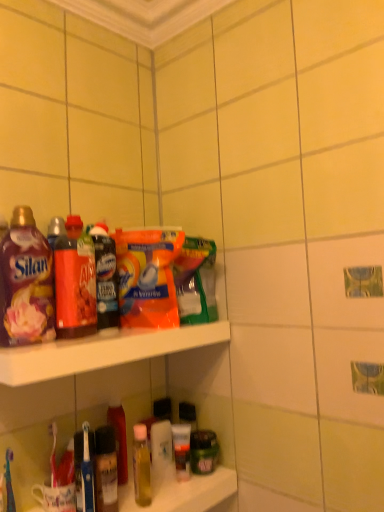
This screenshot has height=512, width=384. Describe the element at coordinates (147, 277) in the screenshot. I see `orange plastic cleaning product at center` at that location.

Measure the distance between point (105,311) and camera.

A distance of 3.42 feet exists between point (105,311) and camera.

Locate an element on the screen. matte plastic shelf at upper center is located at coordinates (102, 351).

At what (x,y) coordinates should I click in order to perform the action: click on matte red bottle at left, placed as the second bottle when sorted from back to front. Please return your answer as a coordinate pair (x, y). Looking at the image, I should click on (75, 282).

The width and height of the screenshot is (384, 512). I want to click on translucent plastic bottle at lower center, the third bottle when ordered from top to bottom, so click(x=119, y=438).

The height and width of the screenshot is (512, 384). I want to click on orange plastic cleaning product at center, so click(x=147, y=277).

Is the depth of matte red bottle at left, arranged as the second bottle when ordered from the bottom, less than that of matte plastic bottle at upper left?

Yes, it is.

Based on the photo, is matte red bottle at left, which is counted as the second bottle, starting from the front, outside of matte plastic bottle at upper left?

Absolutely, matte red bottle at left, which is counted as the second bottle, starting from the front, is external to matte plastic bottle at upper left.

Can you tell me how much matte red bottle at left, which is counted as the second bottle, starting from the front, and matte plastic bottle at upper left differ in facing direction?

The angle between the facing direction of matte red bottle at left, which is counted as the second bottle, starting from the front, and the facing direction of matte plastic bottle at upper left is 0.000106 degrees.

Is matte plastic bottle at upper left facing towards translucent plastic bottle at lower center, which is counted as the 3th bottle, starting from the front?

No, matte plastic bottle at upper left is not facing towards translucent plastic bottle at lower center, which is counted as the 3th bottle, starting from the front.

From a real-world perspective, is matte plastic bottle at upper left above or below translucent plastic bottle at lower center, the third bottle when ordered from top to bottom?

From a real-world perspective, matte plastic bottle at upper left is physically above translucent plastic bottle at lower center, the third bottle when ordered from top to bottom.

Considering the sizes of matte plastic bottle at upper left and translucent plastic bottle at lower center, acting as the first bottle starting from the back, in the image, is matte plastic bottle at upper left bigger or smaller than translucent plastic bottle at lower center, acting as the first bottle starting from the back,?

Considering their sizes, matte plastic bottle at upper left takes up more space than translucent plastic bottle at lower center, acting as the first bottle starting from the back.

Is orange plastic cleaning product at center wider or thinner than translucent plastic bottle at lower center, acting as the first bottle starting from the back?

Clearly, orange plastic cleaning product at center has more width compared to translucent plastic bottle at lower center, acting as the first bottle starting from the back.

From the image's perspective, which is below, orange plastic cleaning product at center or translucent plastic bottle at lower center, acting as the first bottle starting from the back?

translucent plastic bottle at lower center, acting as the first bottle starting from the back, appears lower in the image.

Based on the photo, is orange plastic cleaning product at center turned away from translucent plastic bottle at lower center, the third bottle when ordered from top to bottom?

No, translucent plastic bottle at lower center, the third bottle when ordered from top to bottom, is not at the back of orange plastic cleaning product at center.

Between translucent plastic bottle at lower center, acting as the first bottle starting from the back, and matte plastic bottle at upper left, which one is positioned in front?

matte plastic bottle at upper left is more forward.

Which is in front, point (116, 414) or point (99, 222)?

The point (116, 414) is closer to the camera.

You are a GUI agent. You are given a task and a screenshot of the screen. Output one action in this format:
    pyautogui.click(x=<x>, y=<y>)
    Task: Click on the product above the translucent plastic bottle at lower center, which is counted as the 3th bottle, starting from the front (from a real-world perspective)
    
    Given the screenshot: What is the action you would take?
    pyautogui.click(x=105, y=278)

Considering the positions of points (2, 334) and (138, 355), is point (2, 334) closer to camera compared to point (138, 355)?

Yes, point (2, 334) is closer to viewer.

From a real-world perspective, does matte plastic bottle at left, the first bottle viewed from the top, sit lower than matte plastic shelf at upper center?

No, from a real-world perspective, matte plastic bottle at left, the first bottle viewed from the top, is not below matte plastic shelf at upper center.

Could matte plastic shelf at upper center be considered to be inside matte plastic bottle at left, which is the third bottle from bottom to top?

No.

Is matte plastic bottle at left, which is the third bottle from back to front, shorter than matte plastic shelf at upper center?

No, matte plastic bottle at left, which is the third bottle from back to front, is not shorter than matte plastic shelf at upper center.

How different are the orientations of matte plastic shelf at upper center and orange plastic cleaning product at center in degrees?

matte plastic shelf at upper center and orange plastic cleaning product at center are facing 2.67e-05 degrees away from each other.

Which of these two, matte plastic shelf at upper center or orange plastic cleaning product at center, is bigger?

orange plastic cleaning product at center is bigger.

Is matte plastic shelf at upper center shorter than orange plastic cleaning product at center?

Yes.

How much distance is there between matte plastic shelf at upper center and orange plastic cleaning product at center?

They are 15.53 centimeters apart.

Does matte plastic bottle at upper left have a greater height compared to orange plastic cleaning product at center?

Yes, matte plastic bottle at upper left is taller than orange plastic cleaning product at center.

Is matte plastic bottle at upper left looking in the opposite direction of orange plastic cleaning product at center?

No, matte plastic bottle at upper left is not facing the opposite direction of orange plastic cleaning product at center.

Is matte plastic bottle at upper left next to orange plastic cleaning product at center?

Yes, matte plastic bottle at upper left is with orange plastic cleaning product at center.

Considering their positions, is matte plastic bottle at upper left located in front of or behind orange plastic cleaning product at center?

Visually, matte plastic bottle at upper left is located behind orange plastic cleaning product at center.

Locate an element on the screen. The height and width of the screenshot is (512, 384). bottle that is the 1st object to the left of the matte plastic bottle at upper left, starting at the anchor is located at coordinates pos(75,282).

Image resolution: width=384 pixels, height=512 pixels. I want to click on bottle on the right of the matte plastic bottle at upper left, so coord(119,438).

Looking at the image, which one is located closer to matte plastic shelf at upper center, translucent plastic bottle at lower center, the third bottle when ordered from top to bottom, or orange plastic cleaning product at center?

orange plastic cleaning product at center is closer to matte plastic shelf at upper center.

Estimate the real-world distances between objects in this image. Which object is closer to matte plastic bottle at upper left, matte plastic shelf at upper center or translucent plastic bottle at lower center, the third bottle when ordered from top to bottom?

matte plastic shelf at upper center.

Considering their positions, is translucent plastic bottle at lower center, which ranks as the 1th bottle in bottom-to-top order, positioned further to matte plastic bottle at left, which is the third bottle from bottom to top, than orange plastic cleaning product at center?

translucent plastic bottle at lower center, which ranks as the 1th bottle in bottom-to-top order, lies further to matte plastic bottle at left, which is the third bottle from bottom to top, than the other object.

When comparing their distances from matte plastic shelf at upper center, does matte plastic bottle at left, which is the third bottle from bottom to top, or matte plastic bottle at upper left seem closer?

matte plastic bottle at left, which is the third bottle from bottom to top, is closer to matte plastic shelf at upper center.

Considering their positions, is matte red bottle at left, placed as the second bottle when sorted from back to front, positioned closer to matte plastic bottle at left, which is the third bottle from bottom to top, than orange plastic cleaning product at center?

The object closer to matte plastic bottle at left, which is the third bottle from bottom to top, is matte red bottle at left, placed as the second bottle when sorted from back to front.

Considering their positions, is orange plastic cleaning product at center positioned closer to matte plastic shelf at upper center than matte plastic bottle at upper left?

Among the two, orange plastic cleaning product at center is located nearer to matte plastic shelf at upper center.

Based on their spatial positions, is matte red bottle at left, arranged as the second bottle when ordered from the bottom, or translucent plastic bottle at lower center, which ranks as the 1th bottle in bottom-to-top order, closer to matte plastic shelf at upper center?

matte red bottle at left, arranged as the second bottle when ordered from the bottom, is closer to matte plastic shelf at upper center.

Estimate the real-world distances between objects in this image. Which object is further from matte plastic shelf at upper center, matte plastic bottle at upper left or matte plastic bottle at left, which is the third bottle from bottom to top?

The object further to matte plastic shelf at upper center is matte plastic bottle at upper left.

I want to click on product that lies between matte red bottle at left, arranged as the second bottle when ordered from the bottom, and translucent plastic bottle at lower center, which is counted as the 3th bottle, starting from the front, from top to bottom, so click(105, 278).

In order to click on bottle that lies between matte plastic bottle at left, which is the third bottle from bottom to top, and matte plastic shelf at upper center from top to bottom in this screenshot , I will do `click(75, 282)`.

This screenshot has height=512, width=384. Find the location of `shelf between matte plastic bottle at upper left and translucent plastic bottle at lower center, acting as the first bottle starting from the back, in the up-down direction`. shelf between matte plastic bottle at upper left and translucent plastic bottle at lower center, acting as the first bottle starting from the back, in the up-down direction is located at coordinates (102, 351).

Where is `product between matte plastic bottle at left, which is the third bottle from bottom to top, and orange plastic cleaning product at center from left to right`? product between matte plastic bottle at left, which is the third bottle from bottom to top, and orange plastic cleaning product at center from left to right is located at coordinates (105, 278).